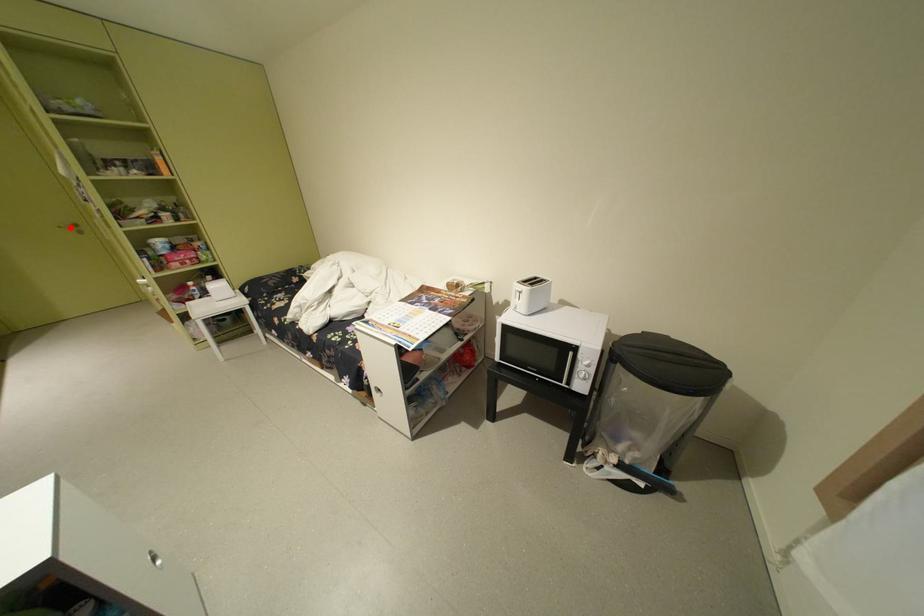
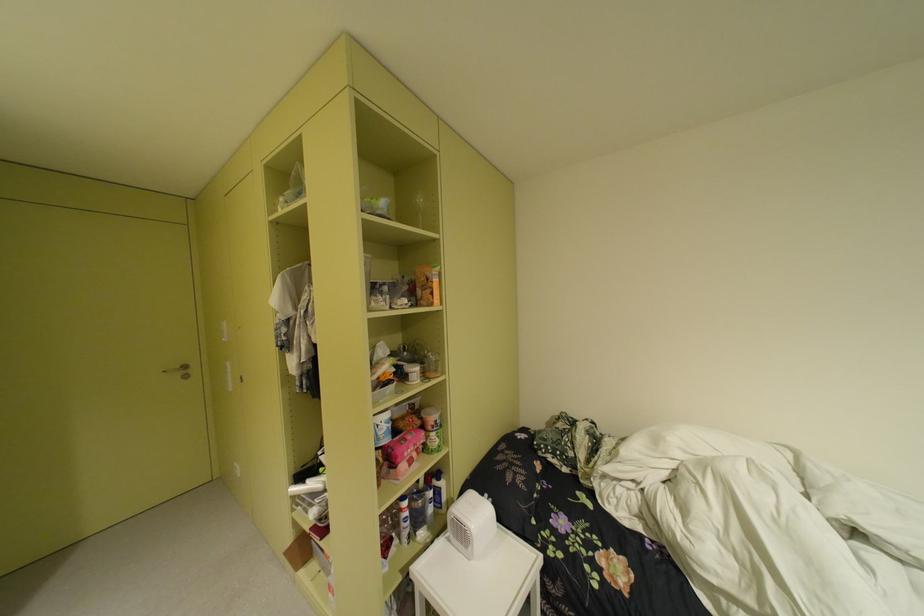
Locate, in the second image, the point that corresponds to the highlighted location in the first image.

(175, 371)